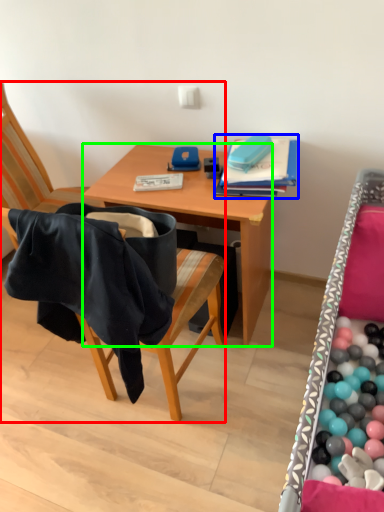
Question: Considering the real-world distances, which object is farthest from chair (highlighted by a red box)? book (highlighted by a blue box) or desk (highlighted by a green box)?

Choices:
 (A) book
 (B) desk

Answer: (A)